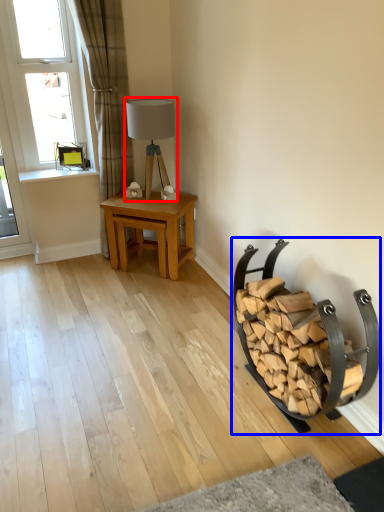
Question: Which object is closer to the camera taking this photo, table lamp (highlighted by a red box) or rocking chair (highlighted by a blue box)?

Choices:
 (A) table lamp
 (B) rocking chair

Answer: (B)